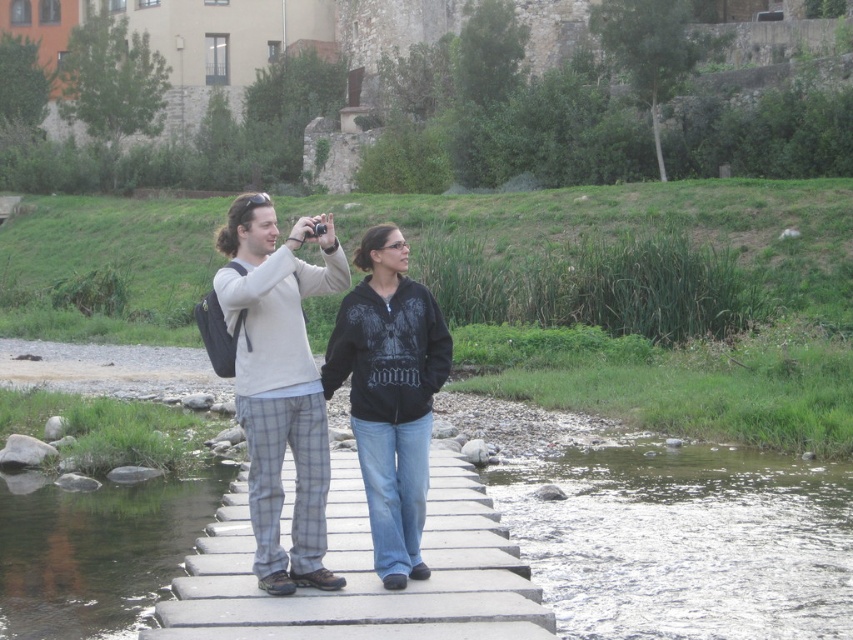
Question: Considering the relative positions of light gray flannel pants at center and black zip-up jacket at center in the image provided, where is light gray flannel pants at center located with respect to black zip-up jacket at center?

Choices:
 (A) above
 (B) below

Answer: (A)

Question: Which object is closer to the camera taking this photo?

Choices:
 (A) black zip-up jacket at center
 (B) light gray flannel pants at center

Answer: (B)

Question: In this image, where is light gray flannel pants at center located relative to black zip-up jacket at center?

Choices:
 (A) above
 (B) below

Answer: (A)

Question: Among these points, which one is nearest to the camera?

Choices:
 (A) (322, 436)
 (B) (404, 289)

Answer: (A)

Question: Can you confirm if light gray flannel pants at center is wider than black zip-up jacket at center?

Choices:
 (A) yes
 (B) no

Answer: (A)

Question: Which object is farther from the camera taking this photo?

Choices:
 (A) black zip-up jacket at center
 (B) light gray flannel pants at center

Answer: (A)